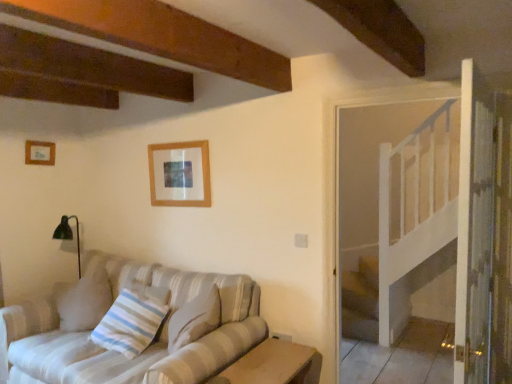
Question: Is wooden picture frame at upper left, the second picture frame when ordered from right to left, spatially inside wooden table at lower center, or outside of it?

Choices:
 (A) outside
 (B) inside

Answer: (A)

Question: In terms of size, does wooden picture frame at upper left, the 1th picture frame viewed from the left, appear bigger or smaller than wooden table at lower center?

Choices:
 (A) small
 (B) big

Answer: (A)

Question: Which of these objects is positioned farthest from the wooden picture frame at upper center, positioned as the 2th picture frame in left-to-right order?

Choices:
 (A) wooden table at lower center
 (B) striped fabric pillow at lower left
 (C) textured beige couch at lower left
 (D) wooden picture frame at upper left, placed as the second picture frame when sorted from front to back

Answer: (A)

Question: Which of these objects is positioned farthest from the striped fabric pillow at lower left?

Choices:
 (A) textured beige couch at lower left
 (B) wooden picture frame at upper left, placed as the second picture frame when sorted from front to back
 (C) wooden picture frame at upper center, arranged as the 1th picture frame when viewed from the right
 (D) wooden table at lower center

Answer: (B)